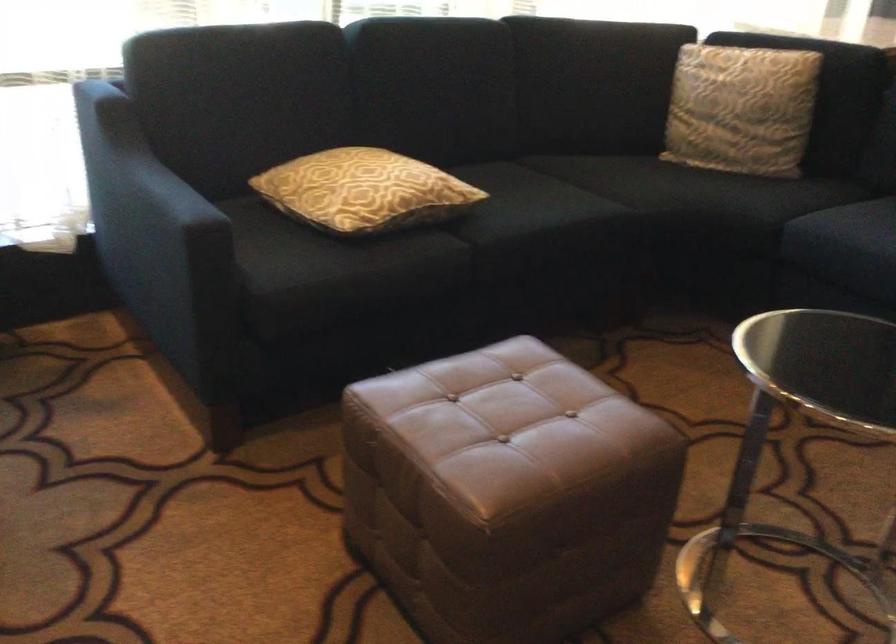
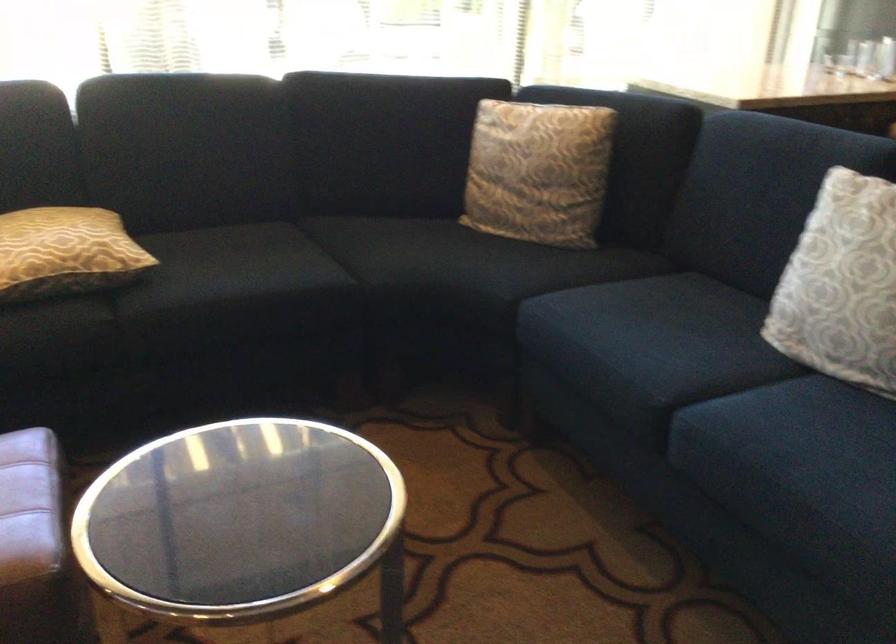
The point at (415,190) is marked in the first image. Where is the corresponding point in the second image?

(65, 252)